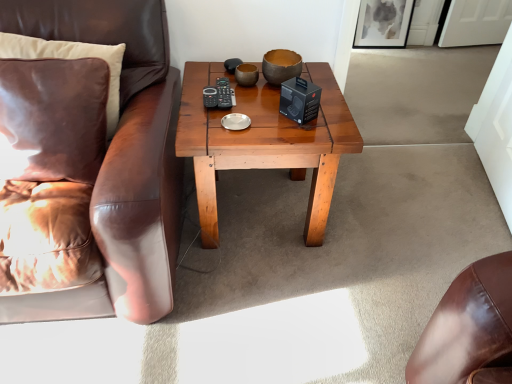
Find the location of a particular element. spots to the right of matte brown bowl at center is located at coordinates (324, 89).